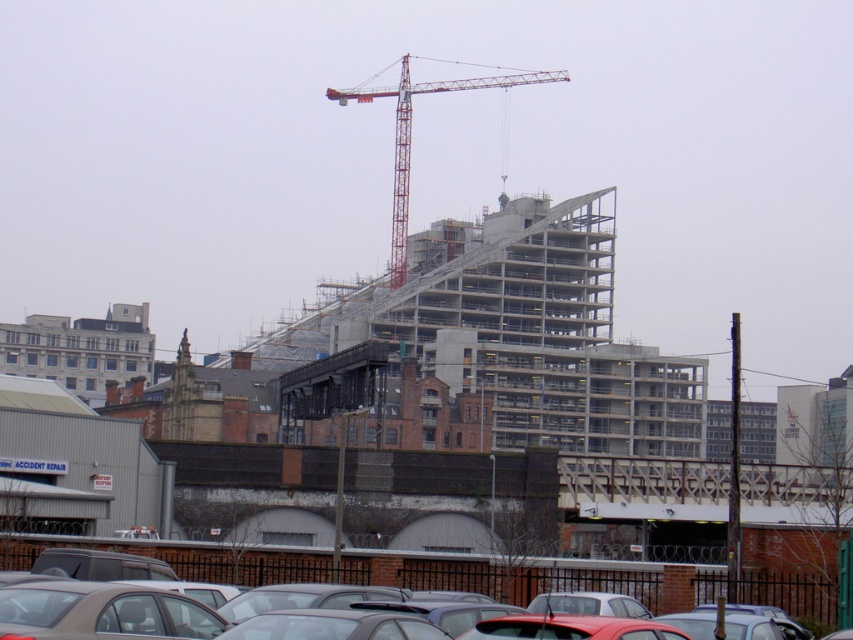
In the scene shown: Is red metal crane at upper center shorter than matte gray car at lower center?

In fact, red metal crane at upper center may be taller than matte gray car at lower center.

Based on the photo, does red metal crane at upper center appear over matte gray car at lower center?

Indeed, red metal crane at upper center is positioned over matte gray car at lower center.

Which is behind, point (482, 81) or point (392, 632)?

The point (482, 81) is more distant.

Locate an element on the screen. The image size is (853, 640). red metal crane at upper center is located at coordinates (410, 132).

Between matte gray sedan at center and matte gray car at lower center, which one appears on the left side from the viewer's perspective?

matte gray sedan at center

Can you confirm if matte gray sedan at center is positioned to the left of matte gray car at lower center?

Indeed, matte gray sedan at center is positioned on the left side of matte gray car at lower center.

Between point (711, 586) and point (354, 616), which one is positioned in front?

Positioned in front is point (354, 616).

Where is `matte gray sedan at center`? The height and width of the screenshot is (640, 853). matte gray sedan at center is located at coordinates (543, 579).

Is matte gray sedan at center wider than red metal crane at upper center?

No.

Measure the distance between matte gray sedan at center and red metal crane at upper center.

They are 190.11 meters apart.

Where is `matte gray sedan at center`? matte gray sedan at center is located at coordinates (543, 579).